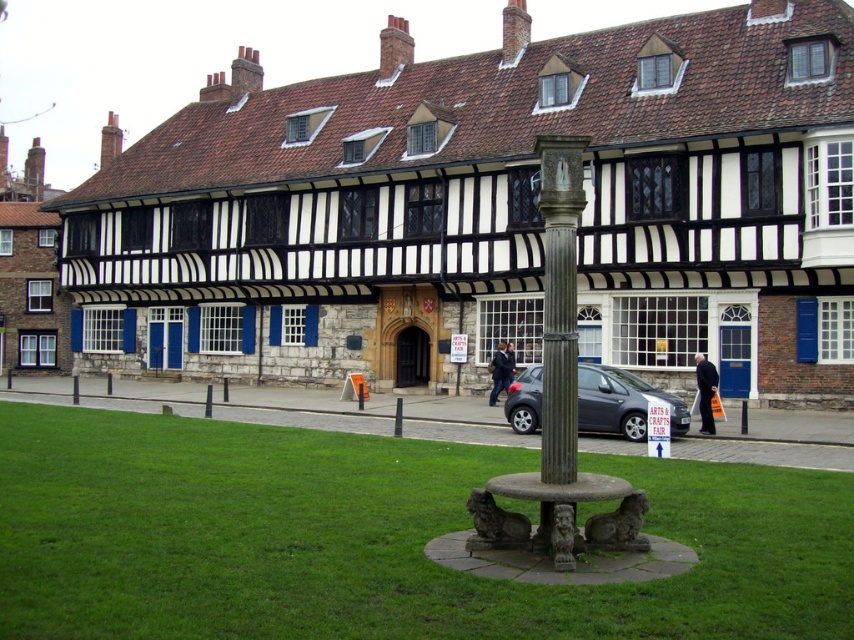
Question: Can you confirm if green grass at center is positioned above matte gray car at center?

Choices:
 (A) no
 (B) yes

Answer: (A)

Question: Can you confirm if green grass at center is thinner than matte gray car at center?

Choices:
 (A) yes
 (B) no

Answer: (B)

Question: Which point is farther from the camera taking this photo?

Choices:
 (A) (642, 433)
 (B) (474, 621)

Answer: (A)

Question: Which of the following is the closest to the observer?

Choices:
 (A) (645, 419)
 (B) (10, 618)

Answer: (B)

Question: Is the position of green grass at center less distant than that of matte gray car at center?

Choices:
 (A) no
 (B) yes

Answer: (B)

Question: Which point is closer to the camera?

Choices:
 (A) matte gray car at center
 (B) green grass at center

Answer: (B)